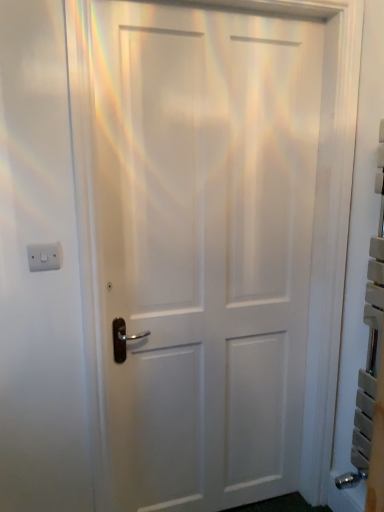
Question: Does white matte door at center have a larger size compared to white plastic/light switch at upper left?

Choices:
 (A) no
 (B) yes

Answer: (B)

Question: Considering the relative positions of white matte door at center and white plastic/light switch at upper left in the image provided, is white matte door at center to the right of white plastic/light switch at upper left from the viewer's perspective?

Choices:
 (A) no
 (B) yes

Answer: (B)

Question: Does white matte door at center have a lesser width compared to white plastic/light switch at upper left?

Choices:
 (A) no
 (B) yes

Answer: (A)

Question: From a real-world perspective, is white matte door at center on white plastic/light switch at upper left?

Choices:
 (A) no
 (B) yes

Answer: (A)

Question: From the image's perspective, is white matte door at center under white plastic/light switch at upper left?

Choices:
 (A) yes
 (B) no

Answer: (A)

Question: Is there a large distance between white matte door at center and white plastic/light switch at upper left?

Choices:
 (A) yes
 (B) no

Answer: (B)

Question: Is white plastic/light switch at upper left aimed at white matte door at center?

Choices:
 (A) no
 (B) yes

Answer: (A)

Question: Could white matte door at center be considered to be inside white plastic/light switch at upper left?

Choices:
 (A) no
 (B) yes

Answer: (A)

Question: Is white plastic/light switch at upper left at the right side of white matte door at center?

Choices:
 (A) yes
 (B) no

Answer: (B)

Question: Is white plastic/light switch at upper left completely or partially outside of white matte door at center?

Choices:
 (A) no
 (B) yes

Answer: (B)

Question: Is white matte door at center at the back of white plastic/light switch at upper left?

Choices:
 (A) no
 (B) yes

Answer: (A)

Question: From a real-world perspective, is white plastic/light switch at upper left on white matte door at center?

Choices:
 (A) yes
 (B) no

Answer: (A)

Question: Is point [253, 29] positioned closer to the camera than point [59, 258]?

Choices:
 (A) closer
 (B) farther

Answer: (B)